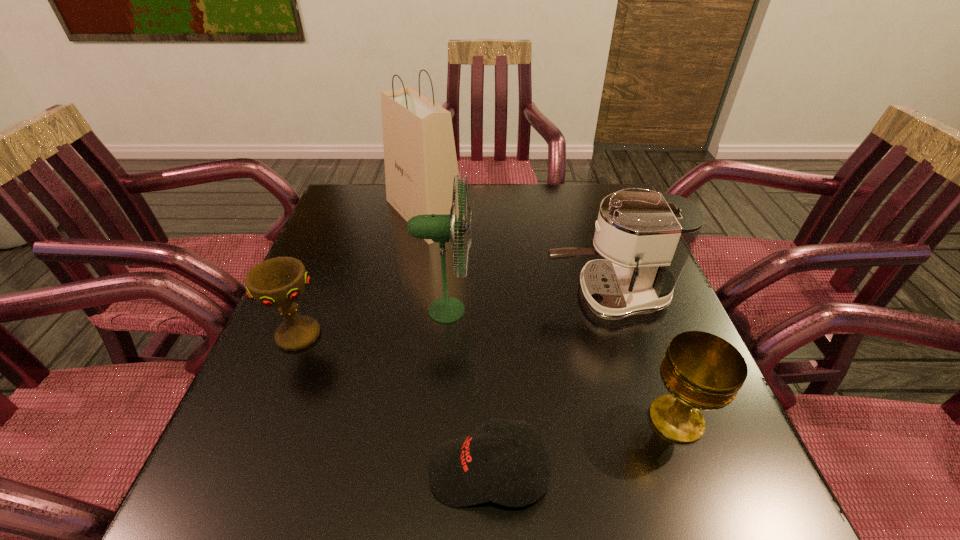
Identify the location of free area in between the second tallest object and the fourth shortest object. (526, 303).

Where is `object that is the closest to the fourth shortest object`? object that is the closest to the fourth shortest object is located at coordinates (440, 228).

Locate which object ranks second in proximity to the coffee maker. Please provide its 2D coordinates. Your answer should be formatted as a tuple, i.e. [(x, y)], where the tuple contains the x and y coordinates of a point satisfying the conditions above.

[(701, 371)]

The width and height of the screenshot is (960, 540). In order to click on vacant space that satisfies the following two spatial constraints: 1. on the front-facing side of the nearer chalice; 2. on the right side of the coffee maker in this screenshot , I will do `click(646, 419)`.

The height and width of the screenshot is (540, 960). In order to click on vacant region that satisfies the following two spatial constraints: 1. on the front side of the shopping bag; 2. on the left side of the nearer chalice in this screenshot , I will do point(389,419).

This screenshot has width=960, height=540. I want to click on vacant space that satisfies the following two spatial constraints: 1. on the front-facing side of the nearer chalice; 2. on the right side of the second tallest object, so click(437, 419).